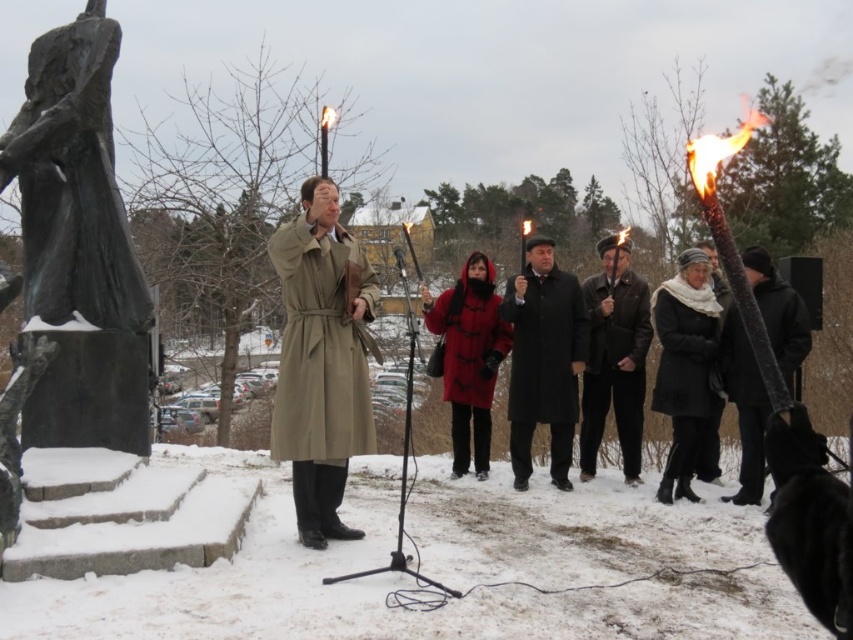
Which is more to the right, tan leather trench coat at center or red woolen coat at center?

From the viewer's perspective, red woolen coat at center appears more on the right side.

Is point (303, 413) positioned in front of point (466, 406)?

Yes.

Identify the location of tan leather trench coat at center. Image resolution: width=853 pixels, height=640 pixels. (321, 360).

Can you confirm if black matte coat at center is positioned to the right of flamematerial/texture at position?

No, black matte coat at center is not to the right of flamematerial/texture at position.

In order to click on black matte coat at center in this screenshot , I will do `click(543, 358)`.

Describe the element at coordinates (543, 358) in the screenshot. The width and height of the screenshot is (853, 640). I see `black matte coat at center` at that location.

Where is `black matte coat at center`? black matte coat at center is located at coordinates (543, 358).

In the scene shown: Does tan leather trench coat at center have a smaller size compared to leather jacket at center?

Correct, tan leather trench coat at center occupies less space than leather jacket at center.

Describe the element at coordinates (321, 360) in the screenshot. The width and height of the screenshot is (853, 640). I see `tan leather trench coat at center` at that location.

Find the location of a particular element. This screenshot has width=853, height=640. tan leather trench coat at center is located at coordinates (321, 360).